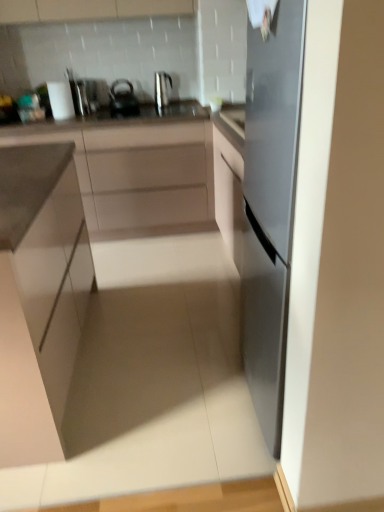
The image size is (384, 512). In order to click on free spot in front of matte black kettle at upper center in this screenshot , I will do `click(123, 115)`.